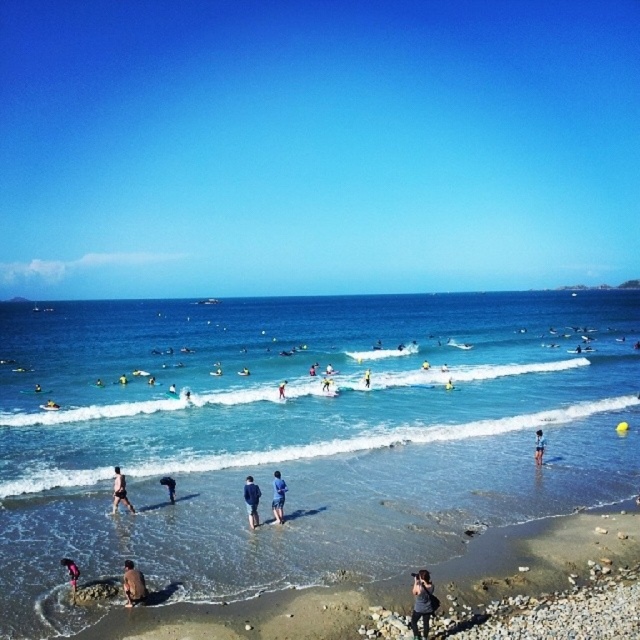
Which is below, pink fabric person at lower left or white fabric surfboard at lower right?

pink fabric person at lower left is lower down.

Who is higher up, pink fabric person at lower left or white fabric surfboard at lower right?

Positioned higher is white fabric surfboard at lower right.

Where is `pink fabric person at lower left`? The width and height of the screenshot is (640, 640). pink fabric person at lower left is located at coordinates (70, 572).

Between skinny man at lower left and pink fabric person at lower left, which one appears on the right side from the viewer's perspective?

Positioned to the right is skinny man at lower left.

Describe the element at coordinates (132, 584) in the screenshot. The width and height of the screenshot is (640, 640). I see `skinny man at lower left` at that location.

Which is behind, point (124, 595) or point (65, 560)?

The point (65, 560) is behind.

Locate an element on the screen. skinny man at lower left is located at coordinates (132, 584).

Does pink fabric person at lower left have a larger size compared to yellow surfboard at center?

No, pink fabric person at lower left is not bigger than yellow surfboard at center.

Between point (72, 570) and point (284, 380), which one is positioned behind?

The point (284, 380) is behind.

Locate an element on the screen. pink fabric person at lower left is located at coordinates (70, 572).